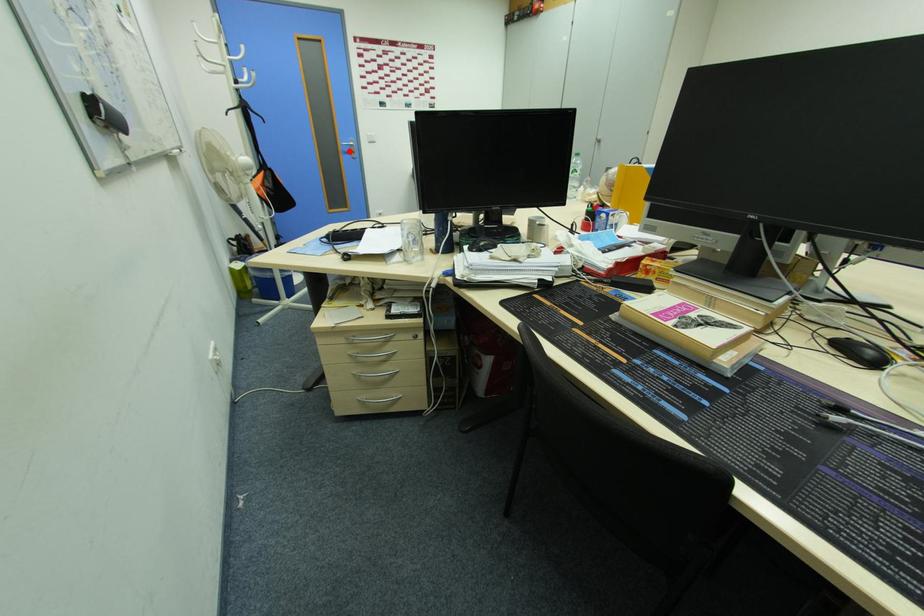
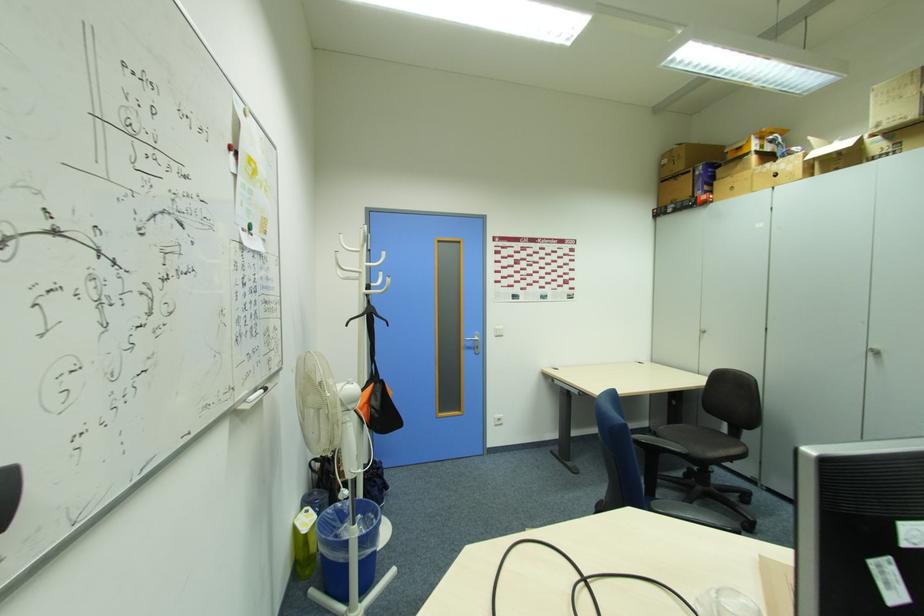
In the second image, find the point that corresponds to the highlighted location in the first image.

(472, 346)